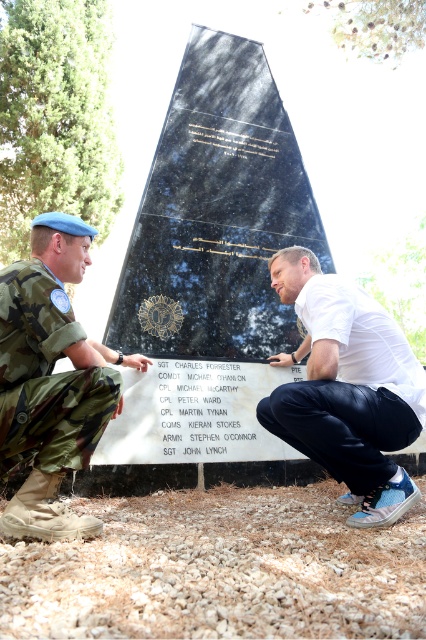
Which is above, camo uniform at left or white matte shirt at center?

Positioned higher is camo uniform at left.

Does camo uniform at left have a larger size compared to white matte shirt at center?

Incorrect, camo uniform at left is not larger than white matte shirt at center.

Which is behind, point (22, 506) or point (402, 486)?

Positioned behind is point (402, 486).

Where is `camo uniform at left`? Image resolution: width=426 pixels, height=640 pixels. camo uniform at left is located at coordinates (51, 380).